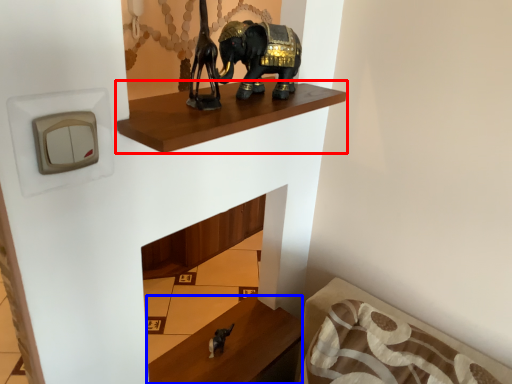
Question: Which point is further to the camera, shelf (highlighted by a red box) or furniture (highlighted by a blue box)?

Choices:
 (A) shelf
 (B) furniture

Answer: (B)